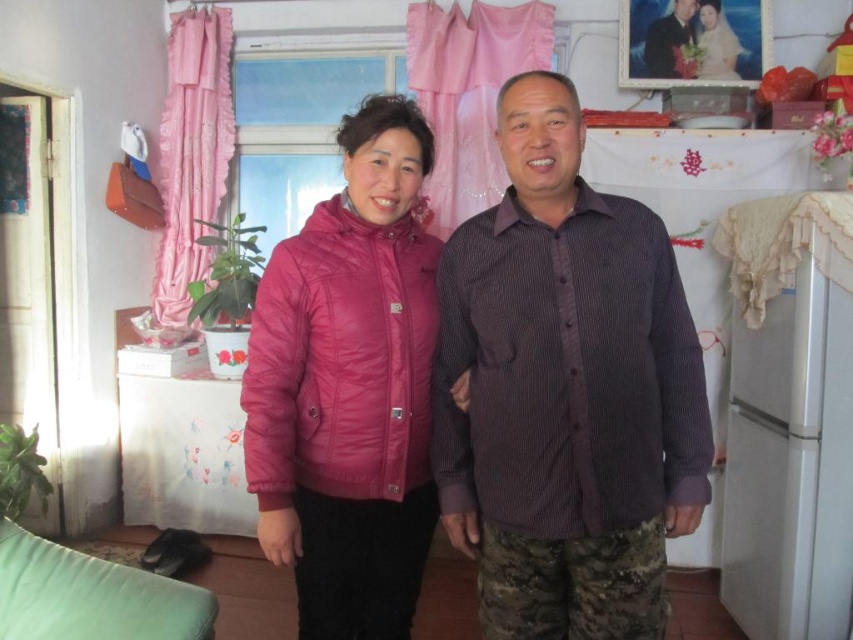
Question: Can you confirm if white matte refrigerator at right is positioned to the right of dark blue corduroy shirt at center?

Choices:
 (A) no
 (B) yes

Answer: (B)

Question: Is purple corduroy shirt at center wider than white matte refrigerator at right?

Choices:
 (A) yes
 (B) no

Answer: (A)

Question: Among these points, which one is farthest from the camera?

Choices:
 (A) (764, 547)
 (B) (292, 422)

Answer: (A)

Question: Is white matte refrigerator at right to the left of dark blue corduroy shirt at center from the viewer's perspective?

Choices:
 (A) yes
 (B) no

Answer: (B)

Question: Which of these objects is positioned farthest from the pink quilted jacket at center?

Choices:
 (A) white matte refrigerator at right
 (B) dark blue corduroy shirt at center

Answer: (B)

Question: Which point appears closest to the camera in this image?

Choices:
 (A) (285, 435)
 (B) (817, 568)

Answer: (A)